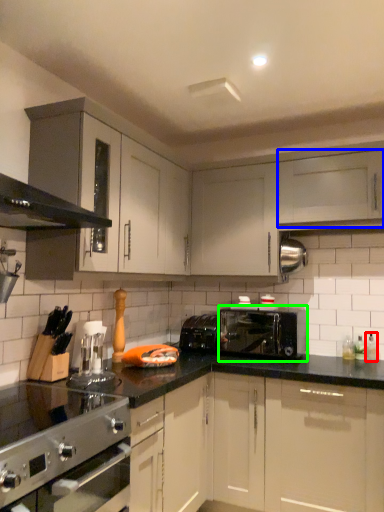
Question: Which is nearer to the bottle (highlighted by a red box)? cabinetry (highlighted by a blue box) or toaster (highlighted by a green box).

Choices:
 (A) cabinetry
 (B) toaster

Answer: (B)